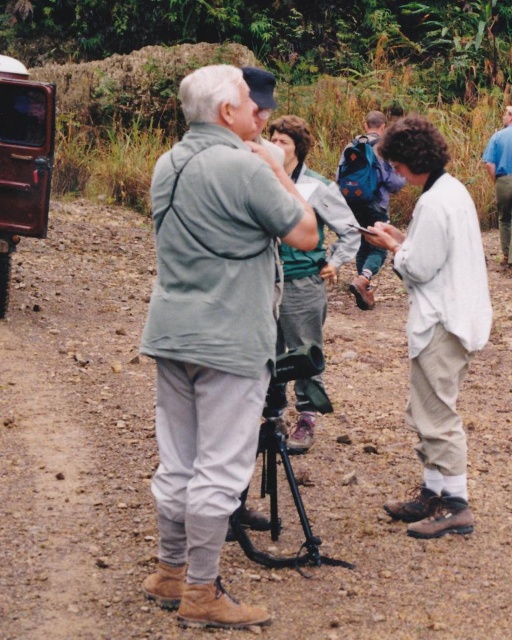
Is brown dirt track at center to the right of matte gray jacket at center from the viewer's perspective?

Correct, you'll find brown dirt track at center to the right of matte gray jacket at center.

Is brown dirt track at center behind matte gray jacket at center?

No, it is not.

At what (x,y) coordinates should I click in order to perform the action: click on brown dirt track at center. Please return your answer as a coordinate pair (x, y). Looking at the image, I should click on (79, 435).

Does point (238, 500) come farther from viewer compared to point (307, 147)?

No, it is not.

Which is in front, point (202, 260) or point (315, 378)?

Point (202, 260) is more forward.

Between point (207, 442) and point (287, 317), which one is positioned in front?

Point (207, 442) is more forward.

Find the location of `gray fabric jacket at center`. gray fabric jacket at center is located at coordinates (212, 332).

Who is lower down, brown dirt track at center or gray fabric jacket at center?

brown dirt track at center

Can you confirm if brown dirt track at center is thinner than gray fabric jacket at center?

Incorrect, brown dirt track at center's width is not less than gray fabric jacket at center's.

The image size is (512, 640). Find the location of `brown dirt track at center`. brown dirt track at center is located at coordinates (79, 435).